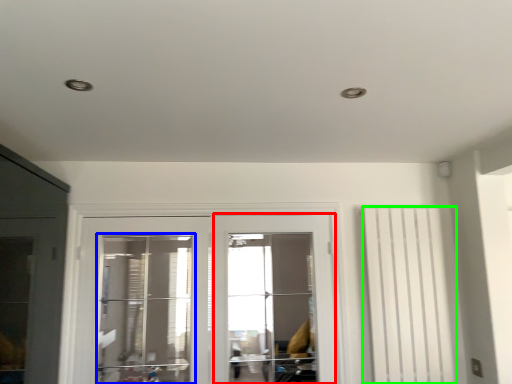
Question: Which object is positioned farthest from screen door (highlighted by a red box)? Select from window (highlighted by a blue box) and curtain (highlighted by a green box).

Choices:
 (A) window
 (B) curtain

Answer: (B)